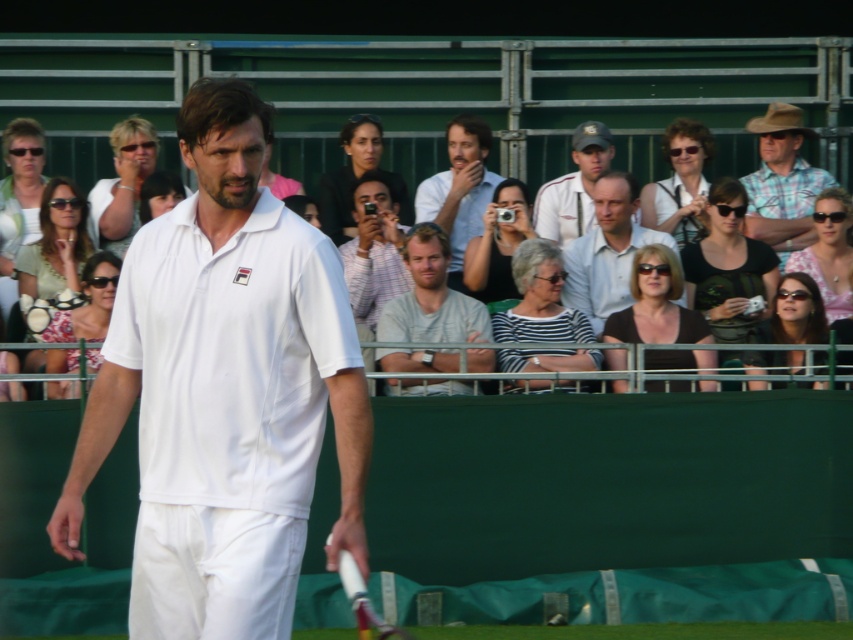
Is white matte tennis shirt at center positioned in front of light brown hair at center?

Yes, white matte tennis shirt at center is in front of light brown hair at center.

Find the location of `white matte tennis shirt at center`. white matte tennis shirt at center is located at coordinates (225, 392).

Where is `white matte tennis shirt at center`? white matte tennis shirt at center is located at coordinates (225, 392).

At what (x,y) coordinates should I click in order to perform the action: click on striped fabric shirt at center. Please return your answer as a coordinate pair (x, y). Looking at the image, I should click on (538, 300).

Can you confirm if striped fabric shirt at center is positioned below matte white sunglasses at upper center?

Yes.

Is point (595, 360) positioned behind point (115, 138)?

No, it is not.

The width and height of the screenshot is (853, 640). I want to click on striped fabric shirt at center, so pyautogui.click(x=538, y=300).

The image size is (853, 640). Describe the element at coordinates (607, 250) in the screenshot. I see `matte white shirt at center` at that location.

Is matte white shirt at center thinner than floral fabric dress at lower left?

No, matte white shirt at center is not thinner than floral fabric dress at lower left.

Measure the distance between point (601, 214) and camera.

Point (601, 214) and camera are 50.77 feet apart from each other.

This screenshot has height=640, width=853. Find the location of `matte white shirt at center`. matte white shirt at center is located at coordinates (607, 250).